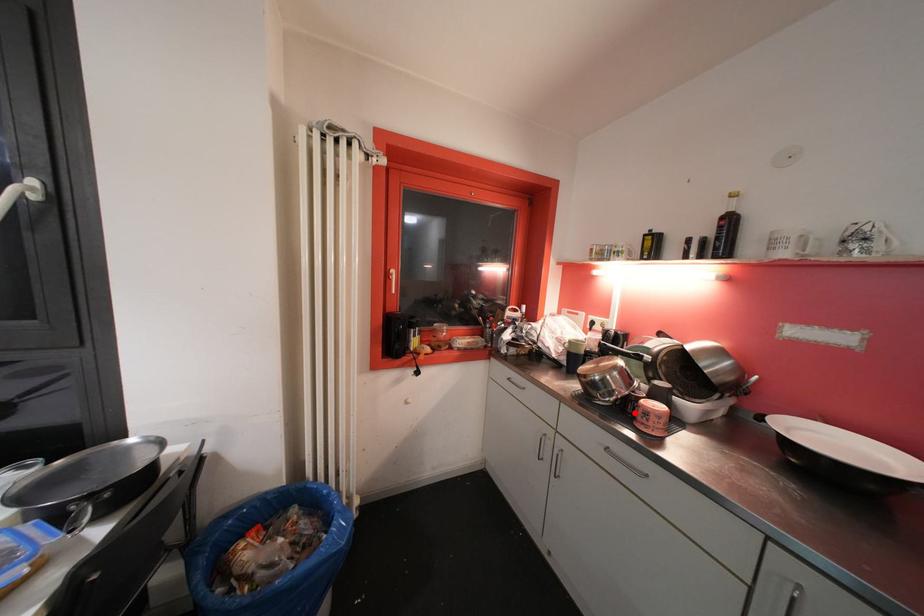
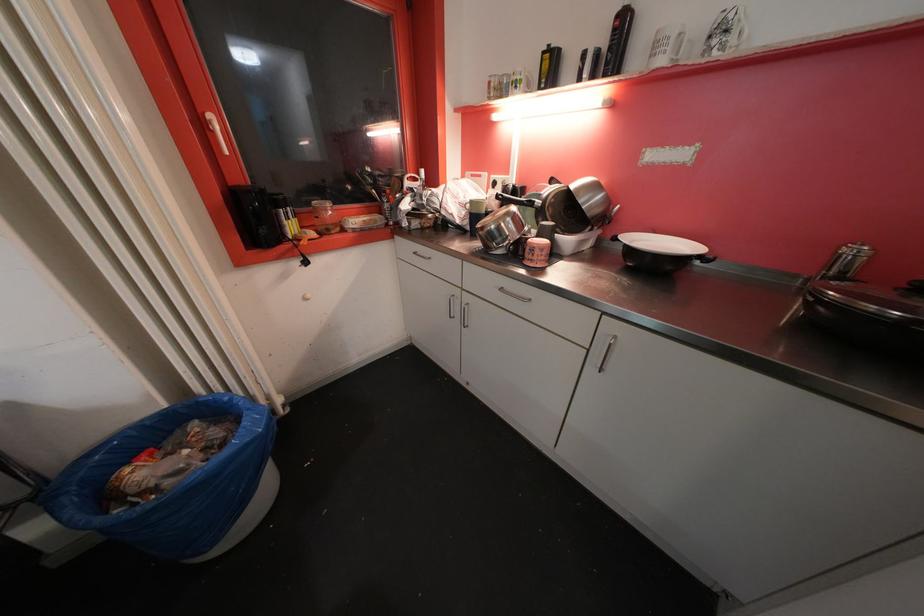
The point at the highlighted location is marked in the first image. Where is the corresponding point in the second image?

(526, 254)